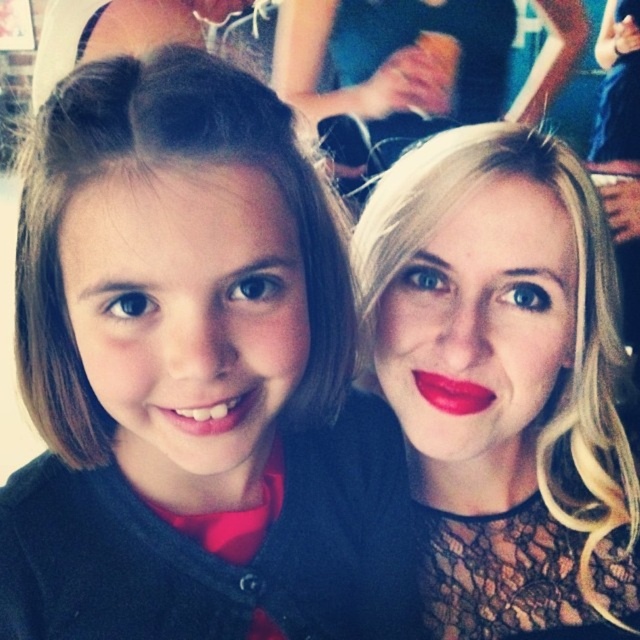
Does brown hair at left come behind blonde hair at right?

No, brown hair at left is closer to the viewer.

Is point (83, 536) farther from camera compared to point (451, 202)?

No, it is not.

Find the location of a particular element. This screenshot has width=640, height=640. brown hair at left is located at coordinates (193, 378).

Who is more distant from viewer, [16,540] or [436,374]?

The point [436,374] is more distant.

Locate an element on the screen. The height and width of the screenshot is (640, 640). brown hair at left is located at coordinates (193, 378).

Measure the distance between brown hair at left and camera.

They are 14.62 inches apart.

Who is lower down, brown hair at left or matte red lipstick at lower center?

brown hair at left is below.

Where is `brown hair at left`? brown hair at left is located at coordinates (193, 378).

The image size is (640, 640). In order to click on brown hair at left in this screenshot , I will do `click(193, 378)`.